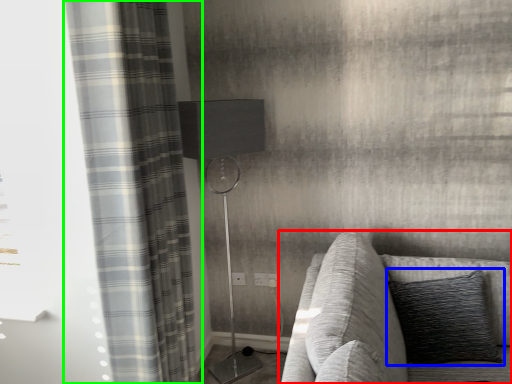
Question: Based on their relative distances, which object is nearer to studio couch (highlighted by a red box)? Choose from pillow (highlighted by a blue box) and curtain (highlighted by a green box).

Choices:
 (A) pillow
 (B) curtain

Answer: (A)